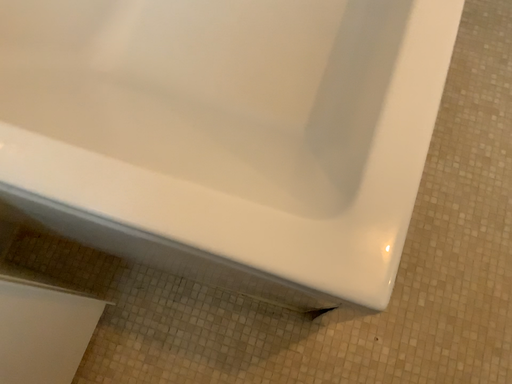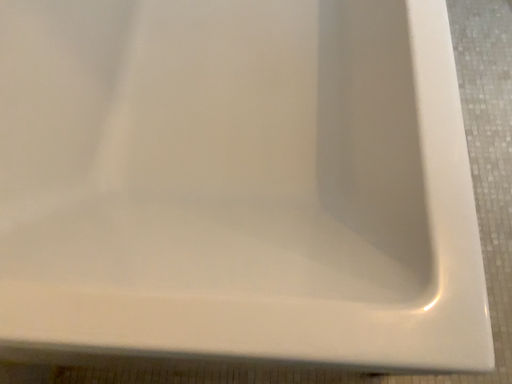
Question: Which way did the camera rotate in the video?

Choices:
 (A) rotated upward
 (B) rotated downward

Answer: (A)